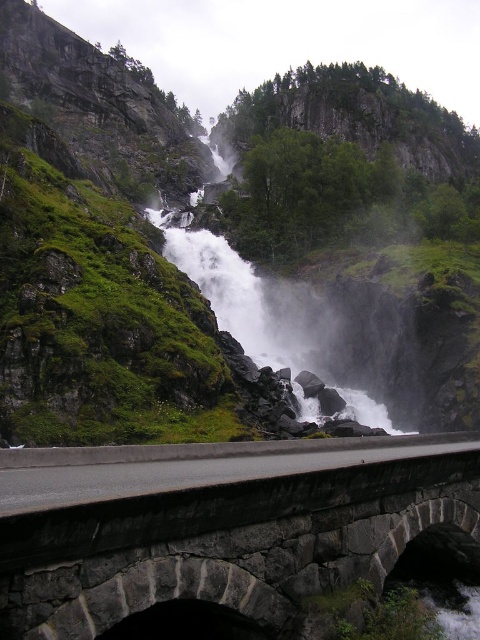
You are a hiker who just finished a long trek and wants to cross the gray asphalt highway at lower center to reach the white mist at center. The bridge you need to use is 40 meters long. Do you think the bridge will be long enough to cross the gap between the two?

The distance between the gray asphalt highway at lower center and white mist at center is 40.85 meters. Since the bridge is only 40 meters long, it will be 0.85 meters too short to cover the entire gap. You will need a longer bridge or find another way to cross safely.

You are standing at the stone bridge and want to determine which of the two points, point (153, 468) or point (224, 172), is closer to you. Based on the scene, which point is nearer?

Point (153, 468) is closer to the viewer than point (224, 172).